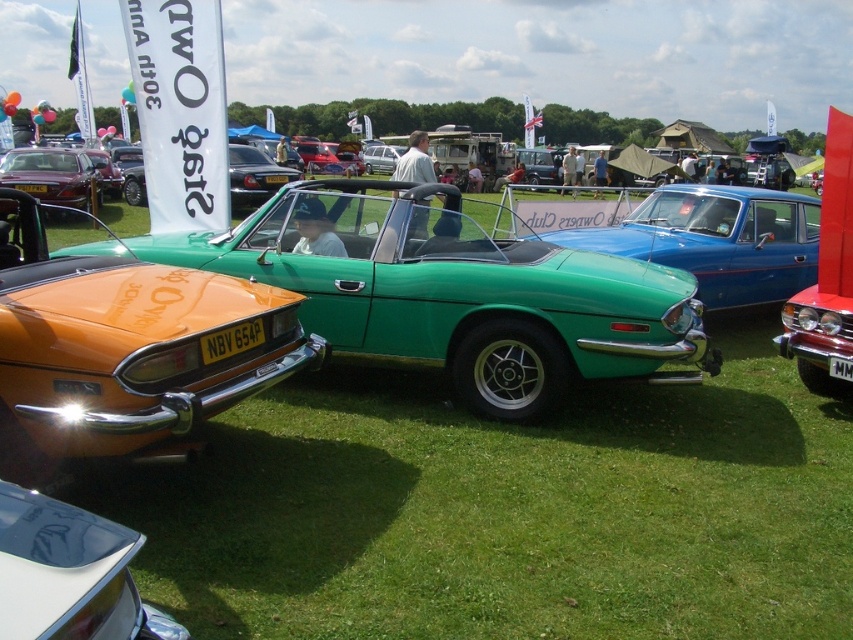
In the scene shown: Can you confirm if green glossy convertible at center is thinner than shiny silver car at lower left?

No.

How far apart are green glossy convertible at center and shiny silver car at lower left?

6.97 meters

Does point (688, 212) lie behind point (22, 595)?

Yes.

Where is `green glossy convertible at center`? Image resolution: width=853 pixels, height=640 pixels. green glossy convertible at center is located at coordinates (717, 240).

Does green glossy convertible at center have a lesser height compared to shiny black convertible at center?

Yes.

The image size is (853, 640). Identify the location of green glossy convertible at center. (717, 240).

Who is positioned more to the right, orange metallic sports car at left or shiny black convertible at center?

orange metallic sports car at left

The height and width of the screenshot is (640, 853). Identify the location of orange metallic sports car at left. (125, 349).

Who is more distant from viewer, (x=154, y=317) or (x=125, y=172)?

Positioned behind is point (x=125, y=172).

You are a GUI agent. You are given a task and a screenshot of the screen. Output one action in this format:
    pyautogui.click(x=<x>, y=<y>)
    Task: Click on the orange metallic sports car at left
    
    Given the screenshot: What is the action you would take?
    pyautogui.click(x=125, y=349)